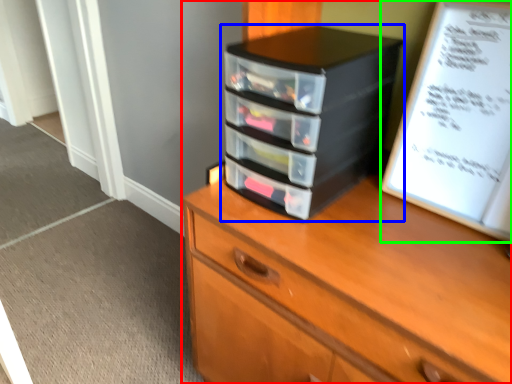
Question: Which is nearer to the chest of drawers (highlighted by a red box)? nightstand (highlighted by a blue box) or paperback book (highlighted by a green box).

Choices:
 (A) nightstand
 (B) paperback book

Answer: (A)